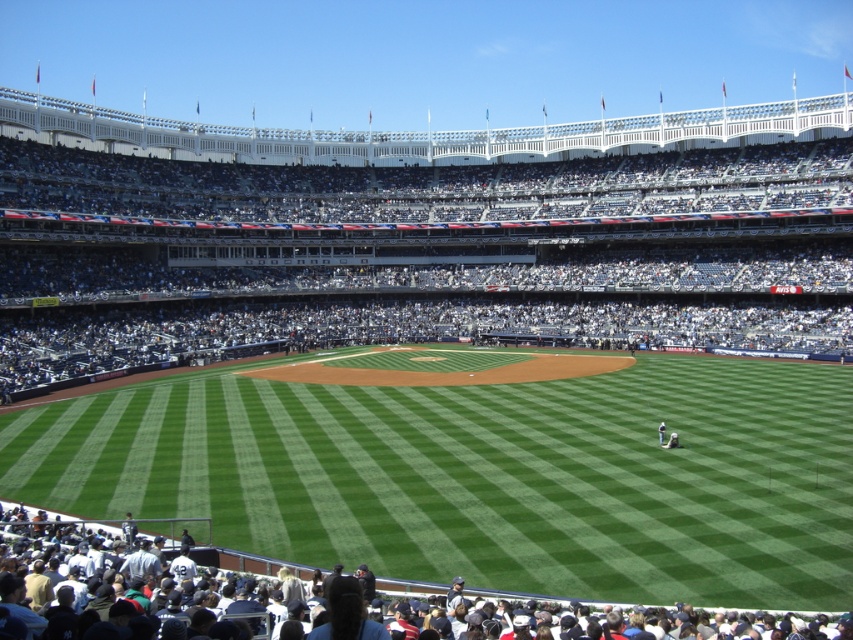
Question: Does green grass at center appear over white cotton shirt at lower center?

Choices:
 (A) no
 (B) yes

Answer: (B)

Question: Observing the image, what is the correct spatial positioning of green grass at center in reference to white cotton shirt at lower center?

Choices:
 (A) right
 (B) left

Answer: (A)

Question: Among these objects, which one is farthest from the camera?

Choices:
 (A) green grass at center
 (B) white cotton shirt at lower center

Answer: (A)

Question: Among these objects, which one is farthest from the camera?

Choices:
 (A) green grass at center
 (B) white cotton shirt at lower center

Answer: (A)

Question: Does green grass at center have a lesser width compared to white cotton shirt at lower center?

Choices:
 (A) no
 (B) yes

Answer: (A)

Question: Which object appears closest to the camera in this image?

Choices:
 (A) white cotton shirt at lower center
 (B) green grass at center

Answer: (A)